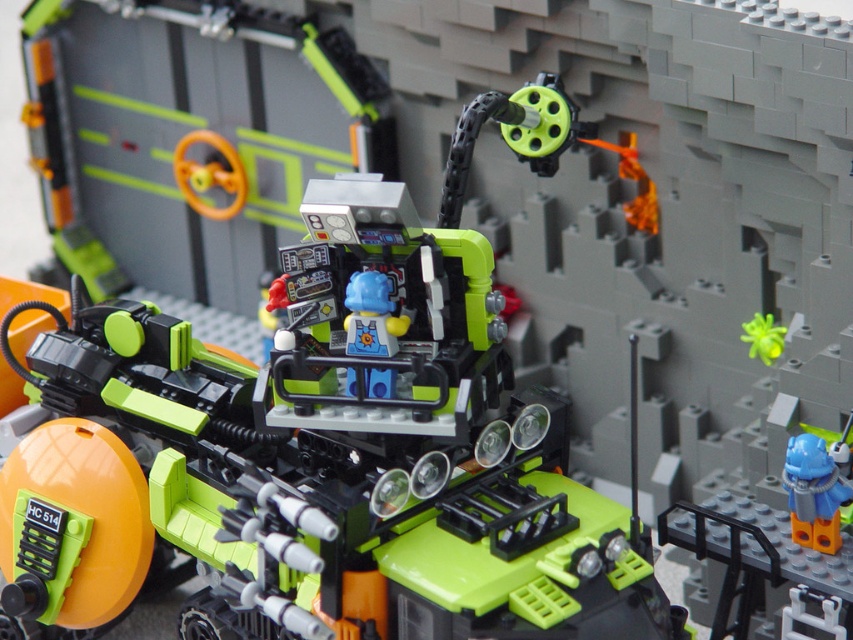
Question: Which point appears farthest from the camera in this image?

Choices:
 (A) (805, 484)
 (B) (151, 456)

Answer: (B)

Question: Among these points, which one is nearest to the camera?

Choices:
 (A) (801, 460)
 (B) (358, 445)

Answer: (A)

Question: Does green matte vehicle at center have a larger size compared to blue matte helmet at center?

Choices:
 (A) yes
 (B) no

Answer: (A)

Question: Does green matte vehicle at center appear under blue matte helmet at center?

Choices:
 (A) yes
 (B) no

Answer: (B)

Question: Does green matte vehicle at center have a smaller size compared to blue matte helmet at center?

Choices:
 (A) no
 (B) yes

Answer: (A)

Question: Which object is farther from the camera taking this photo?

Choices:
 (A) green matte vehicle at center
 (B) blue matte helmet at center

Answer: (B)